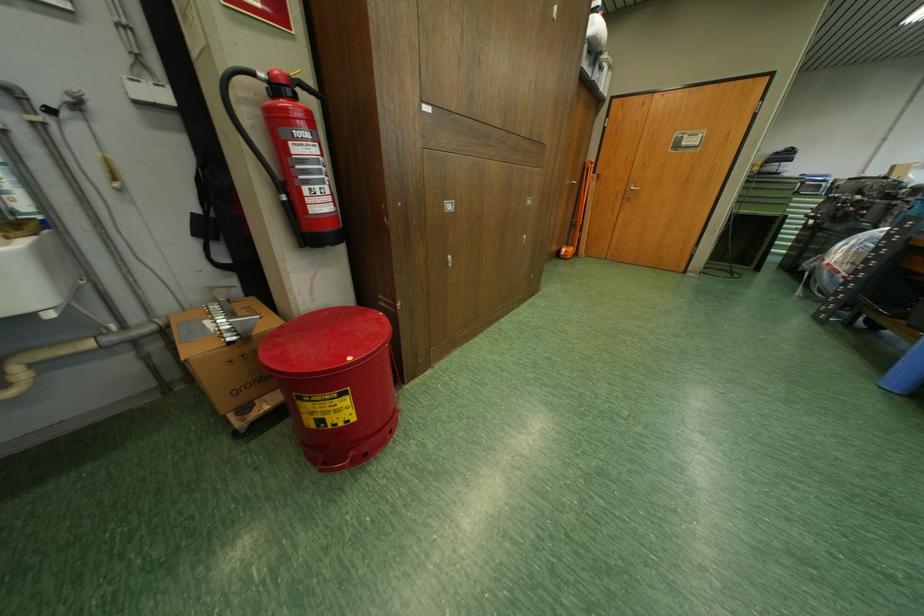
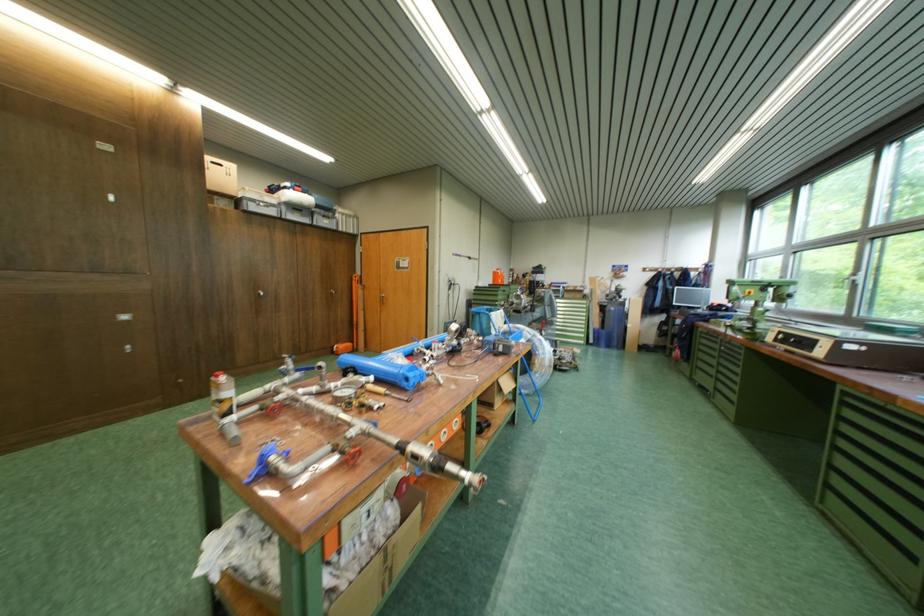
Find the pixel in the second image that matches pixel 536 204 in the first image.

(127, 321)